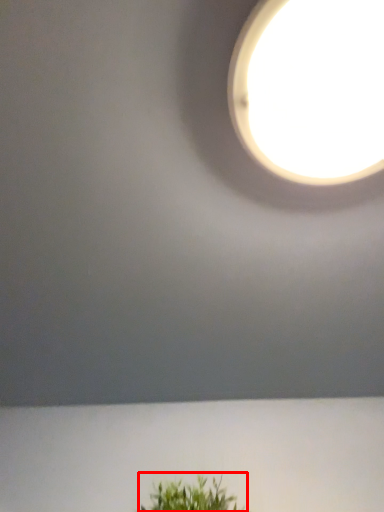
Question: Observing the image, what is the correct spatial positioning of houseplant (annotated by the red box) in reference to lamp?

Choices:
 (A) right
 (B) left

Answer: (B)